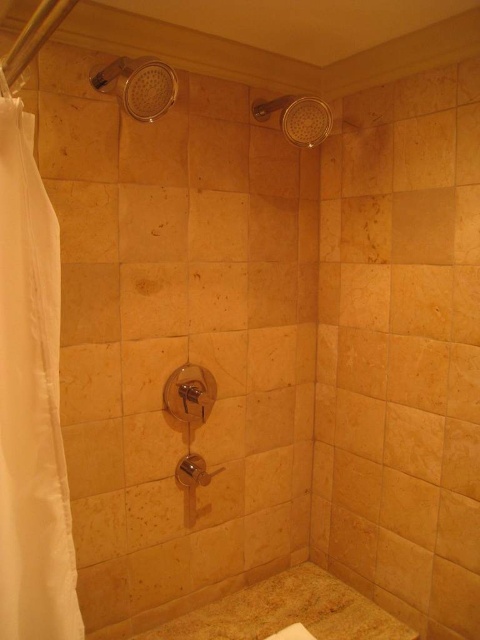
Question: Among these objects, which one is nearest to the camera?

Choices:
 (A) matte stone bathtub at lower center
 (B) white fabric shower curtain at left

Answer: (B)

Question: Is white fabric shower curtain at left bigger than matte silver showerhead at upper left?

Choices:
 (A) yes
 (B) no

Answer: (A)

Question: Considering the real-world distances, which object is closest to the clear plastic showerhead at upper center?

Choices:
 (A) matte stone bathtub at lower center
 (B) matte silver showerhead at upper left

Answer: (B)

Question: Is matte stone bathtub at lower center to the right of clear plastic showerhead at upper center from the viewer's perspective?

Choices:
 (A) yes
 (B) no

Answer: (B)

Question: Does matte stone bathtub at lower center come behind clear plastic showerhead at upper center?

Choices:
 (A) no
 (B) yes

Answer: (B)

Question: Which point appears closest to the camera in this image?

Choices:
 (A) (327, 577)
 (B) (48, 285)
 (C) (95, 77)
 (D) (297, 131)

Answer: (B)